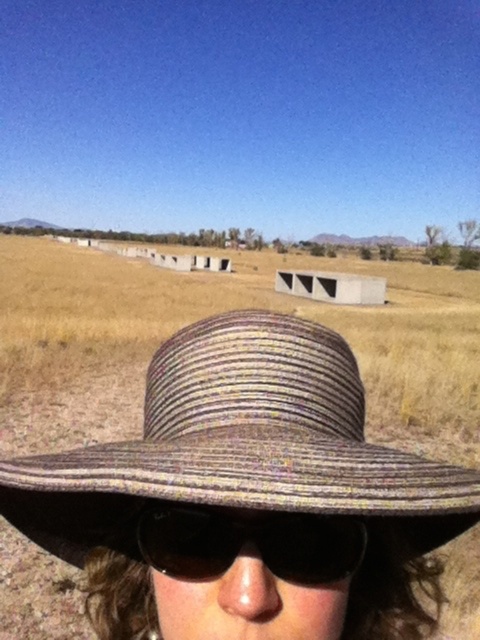
Does woven straw hat at center come behind black reflective sunglasses at center?

No, it is not.

Who is lower down, woven straw hat at center or black reflective sunglasses at center?

black reflective sunglasses at center

The width and height of the screenshot is (480, 640). I want to click on woven straw hat at center, so click(x=239, y=445).